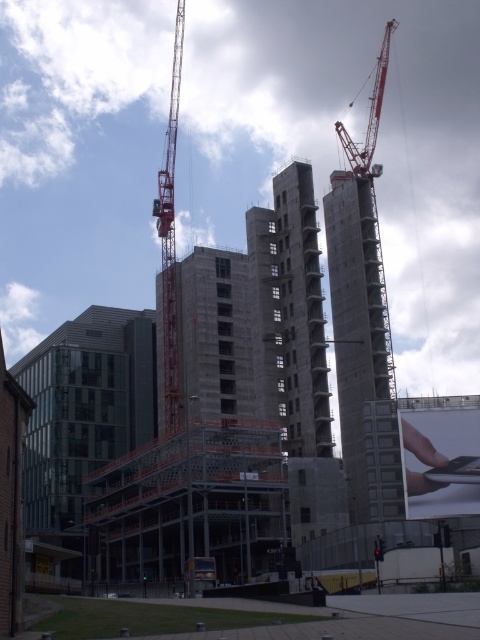
Question: Does concrete tower at center have a smaller size compared to red metal crane at center?

Choices:
 (A) yes
 (B) no

Answer: (A)

Question: Among these points, which one is nearest to the camera?

Choices:
 (A) (382, 97)
 (B) (165, 227)
 (C) (376, 484)

Answer: (C)

Question: Which object is positioned farthest from the concrete tower at center?

Choices:
 (A) concrete/cement crane at upper right
 (B) red metal crane at center

Answer: (B)

Question: Does red metal crane at center appear under concrete/cement crane at upper right?

Choices:
 (A) no
 (B) yes

Answer: (B)

Question: Is red metal crane at center closer to camera compared to concrete/cement crane at upper right?

Choices:
 (A) no
 (B) yes

Answer: (B)

Question: Which of the following is the farthest from the observer?

Choices:
 (A) (380, 60)
 (B) (173, 378)
 (C) (380, 346)

Answer: (A)